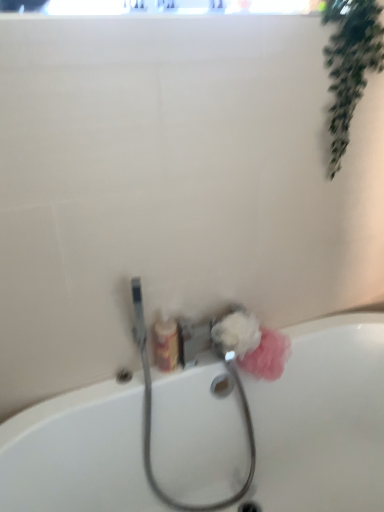
Question: Is green leafy plant at upper right turned away from white ceramic bathtub at lower center?

Choices:
 (A) no
 (B) yes

Answer: (A)

Question: Is green leafy plant at upper right not within white ceramic bathtub at lower center?

Choices:
 (A) yes
 (B) no

Answer: (A)

Question: Is green leafy plant at upper right at the right side of white ceramic bathtub at lower center?

Choices:
 (A) no
 (B) yes

Answer: (B)

Question: Is green leafy plant at upper right to the left of white ceramic bathtub at lower center from the viewer's perspective?

Choices:
 (A) no
 (B) yes

Answer: (A)

Question: Is white ceramic bathtub at lower center located within green leafy plant at upper right?

Choices:
 (A) no
 (B) yes

Answer: (A)

Question: Considering the positions of point (279, 338) and point (228, 313), is point (279, 338) closer or farther from the camera than point (228, 313)?

Choices:
 (A) closer
 (B) farther

Answer: (B)

Question: In terms of size, does pink fluffy sponge at lower right, arranged as the 2th flower when viewed from the left, appear bigger or smaller than white fluffy sponge at lower center, which is counted as the 1th flower, starting from the left?

Choices:
 (A) small
 (B) big

Answer: (B)

Question: Relative to white fluffy sponge at lower center, the second flower when ordered from right to left, is pink fluffy sponge at lower right, arranged as the 2th flower when viewed from the left, in front or behind?

Choices:
 (A) front
 (B) behind

Answer: (B)

Question: In terms of width, does pink fluffy sponge at lower right, which appears as the first flower when viewed from the right, look wider or thinner when compared to white fluffy sponge at lower center, which is counted as the 1th flower, starting from the left?

Choices:
 (A) thin
 (B) wide

Answer: (A)

Question: From a real-world perspective, is green leafy plant at upper right physically located above or below white fluffy sponge at lower center, which is counted as the 1th flower, starting from the left?

Choices:
 (A) above
 (B) below

Answer: (A)

Question: From the image's perspective, relative to white fluffy sponge at lower center, which is counted as the 1th flower, starting from the left, is green leafy plant at upper right above or below?

Choices:
 (A) above
 (B) below

Answer: (A)

Question: Do you think green leafy plant at upper right is within white fluffy sponge at lower center, which is counted as the 1th flower, starting from the left, or outside of it?

Choices:
 (A) outside
 (B) inside

Answer: (A)

Question: Does point (347, 121) appear closer or farther from the camera than point (230, 318)?

Choices:
 (A) farther
 (B) closer

Answer: (A)

Question: In terms of width, does metallic silver garden hose at lower center look wider or thinner when compared to white fluffy sponge at lower center, the second flower when ordered from right to left?

Choices:
 (A) wide
 (B) thin

Answer: (A)

Question: Considering the positions of metallic silver garden hose at lower center and white fluffy sponge at lower center, which is counted as the 1th flower, starting from the left, in the image, is metallic silver garden hose at lower center taller or shorter than white fluffy sponge at lower center, which is counted as the 1th flower, starting from the left,?

Choices:
 (A) tall
 (B) short

Answer: (A)